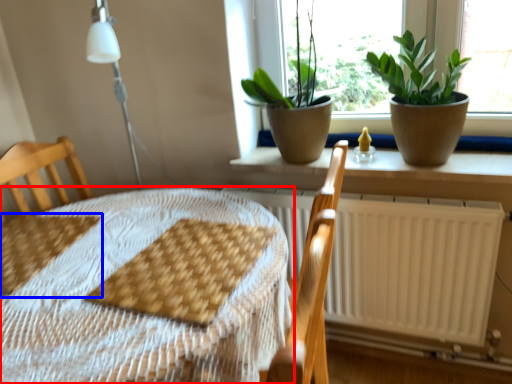
Question: Which object appears farthest to the camera in this image, table (highlighted by a red box) or sheet (highlighted by a blue box)?

Choices:
 (A) table
 (B) sheet

Answer: (B)